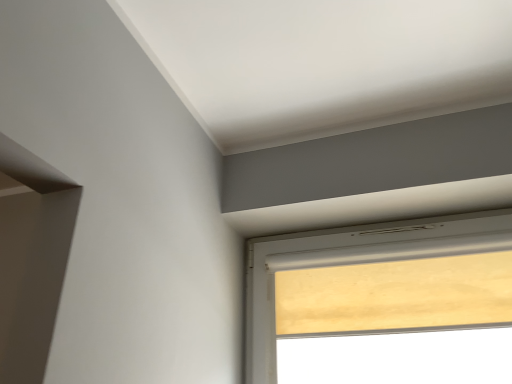
I want to click on matte yellow screen at upper right, so click(x=395, y=295).

What do you see at coordinates (395, 295) in the screenshot? I see `matte yellow screen at upper right` at bounding box center [395, 295].

Identify the location of matte yellow screen at upper right. This screenshot has height=384, width=512. (395, 295).